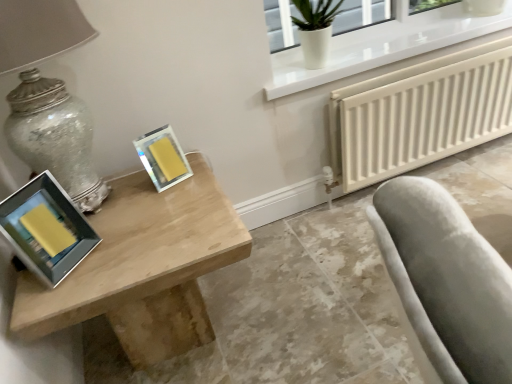
This screenshot has width=512, height=384. I want to click on vacant space that is in between matte yellow picture frame at left, marked as the 2th picture frame in a right-to-left arrangement, and yellow matte picture frame at upper center, which is counted as the 1th picture frame, starting from the right, so click(125, 210).